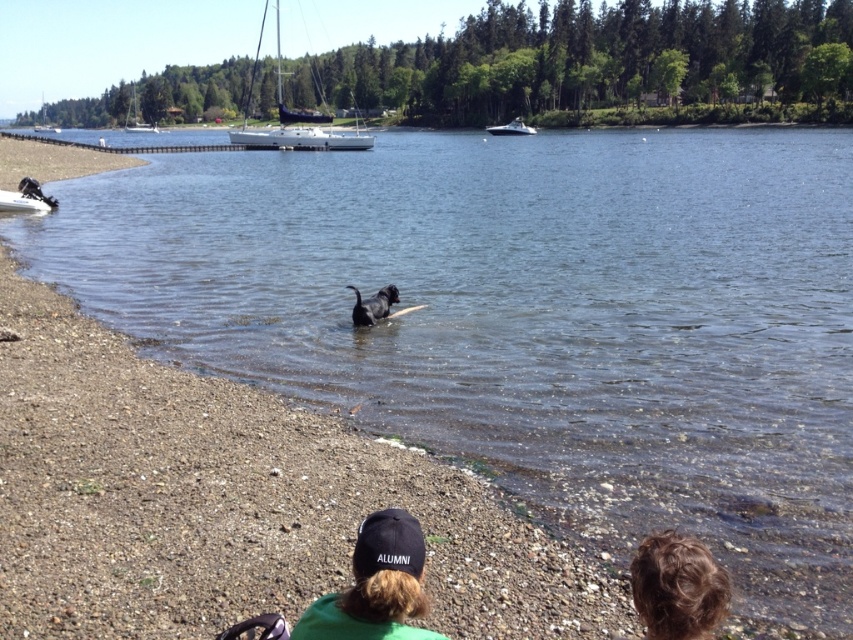
Does black fabric cap at lower center have a lesser width compared to black matte dog at center?

Correct, black fabric cap at lower center's width is less than black matte dog at center's.

I want to click on black fabric cap at lower center, so click(x=375, y=586).

Is point (392, 552) positioned in front of point (357, 316)?

Yes, point (392, 552) is closer to viewer.

The width and height of the screenshot is (853, 640). Find the location of `black fabric cap at lower center`. black fabric cap at lower center is located at coordinates (375, 586).

Can you confirm if black fabric cap at lower center is taller than white plastic boat at center?

No, black fabric cap at lower center is not taller than white plastic boat at center.

Locate an element on the screen. black fabric cap at lower center is located at coordinates (375, 586).

Looking at this image, who is positioned more to the left, black sailboat at upper center or white plastic boat at center?

From the viewer's perspective, black sailboat at upper center appears more on the left side.

Between point (233, 138) and point (496, 129), which one is positioned behind?

The point (496, 129) is more distant.

The width and height of the screenshot is (853, 640). Find the location of `black sailboat at upper center`. black sailboat at upper center is located at coordinates (294, 120).